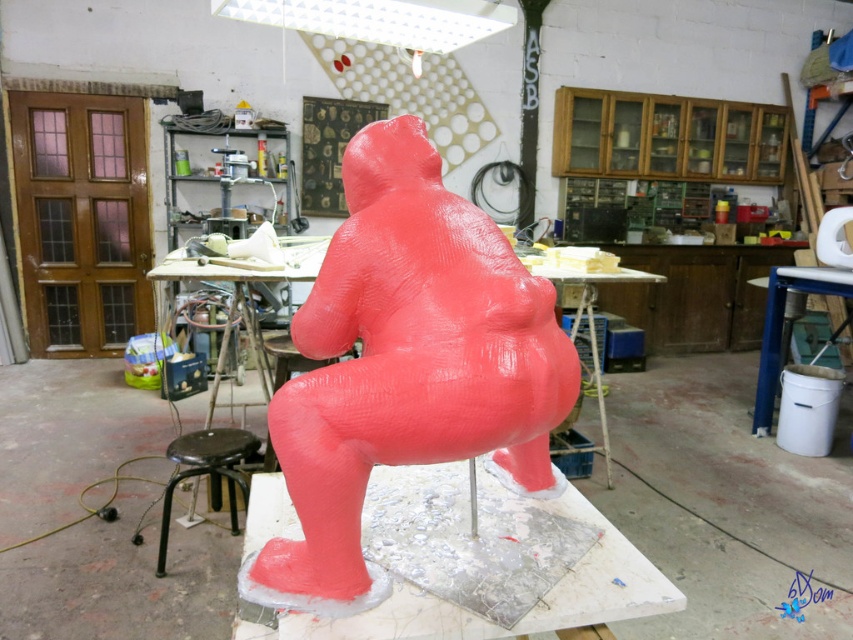
Question: Does matte pink sculpture at center appear on the right side of black metal stool at lower left?

Choices:
 (A) no
 (B) yes

Answer: (B)

Question: Which point appears farthest from the camera in this image?

Choices:
 (A) (259, 440)
 (B) (366, 202)

Answer: (A)

Question: Which object is closer to the camera taking this photo?

Choices:
 (A) black metal stool at lower left
 (B) matte pink sculpture at center

Answer: (B)

Question: Considering the relative positions of matte pink sculpture at center and black metal stool at lower left in the image provided, where is matte pink sculpture at center located with respect to black metal stool at lower left?

Choices:
 (A) above
 (B) below

Answer: (A)

Question: Does matte pink sculpture at center appear on the left side of black metal stool at lower left?

Choices:
 (A) no
 (B) yes

Answer: (A)

Question: Which point is farther to the camera?

Choices:
 (A) (229, 481)
 (B) (379, 344)

Answer: (A)